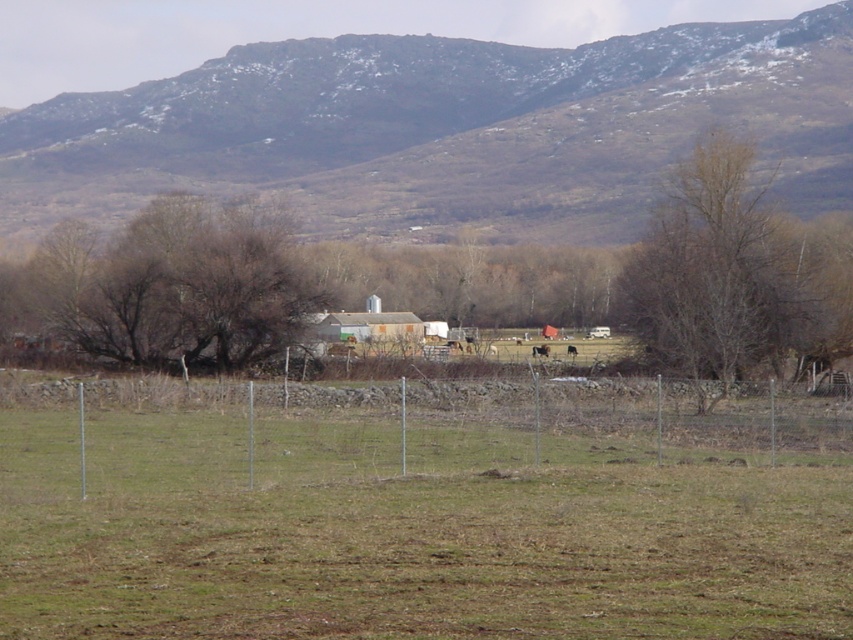
You are standing in the farm field and want to hide behind an object to avoid the rain. Which object between the bare wood tree at right and the brown furry cow at center would provide better coverage from the rain?

The bare wood tree at right might be wider than brown furry cow at center, so it would provide better coverage from the rain.

You are a farmer checking the field. You notice a bare wood tree at right and a brown furry cow at center. Which object is larger in size?

The bare wood tree at right is bigger than the brown furry cow at center.

You are a farmer standing at the edge of your field looking towards the center of the image. You notice both the brown leafless tree at center and the brown furry cow at center. Which object is higher in elevation compared to the other?

The brown leafless tree at center is positioned over the brown furry cow at center, so the tree is higher in elevation than the cow.